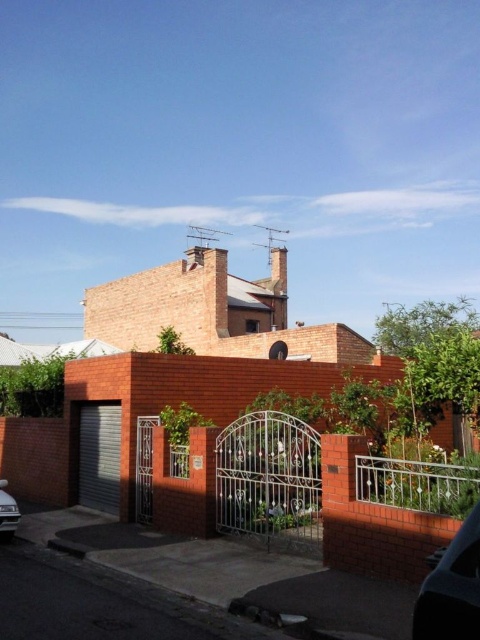
Question: Which point is closer to the camera?

Choices:
 (A) shiny black car at lower right
 (B) shiny silver car at lower left

Answer: (A)

Question: Does shiny black car at lower right have a larger size compared to shiny silver car at lower left?

Choices:
 (A) no
 (B) yes

Answer: (A)

Question: Is shiny black car at lower right bigger than shiny silver car at lower left?

Choices:
 (A) yes
 (B) no

Answer: (B)

Question: Can you confirm if shiny black car at lower right is smaller than shiny silver car at lower left?

Choices:
 (A) no
 (B) yes

Answer: (B)